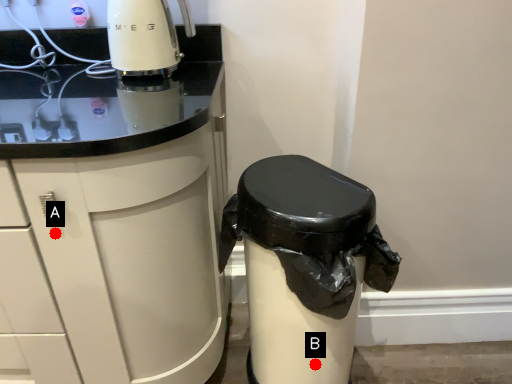
Question: Two points are circled on the image, labeled by A and B beside each circle. Which point is closer to the camera taking this photo?

Choices:
 (A) A is closer
 (B) B is closer

Answer: (A)